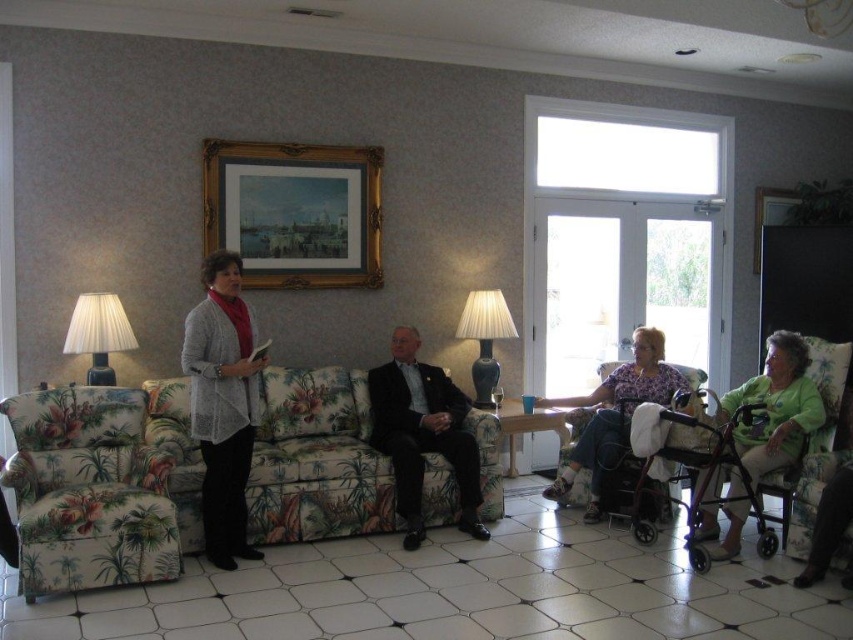
You are standing at the entrance of the living room and want to sit in the floral fabric armchair at left. Which direction should you walk to reach it?

The floral fabric armchair at left is located at point 0.767 on the x axis and 0.104 on the y axis, so you should walk to the left side of the room to reach it.

You are a guest at a party and want to sit between the gray knitted sweater at center and the black suit at center. Which direction should you move to sit between them?

The gray knitted sweater at center is positioned on the left side of black suit at center. To sit between them, you should move to the left side of the black suit at center, between the two objects.

You are a guest at a party and you see the gray knitted sweater at center and the black suit at center. Which clothing item is taller?

The gray knitted sweater at center is taller than the black suit at center.